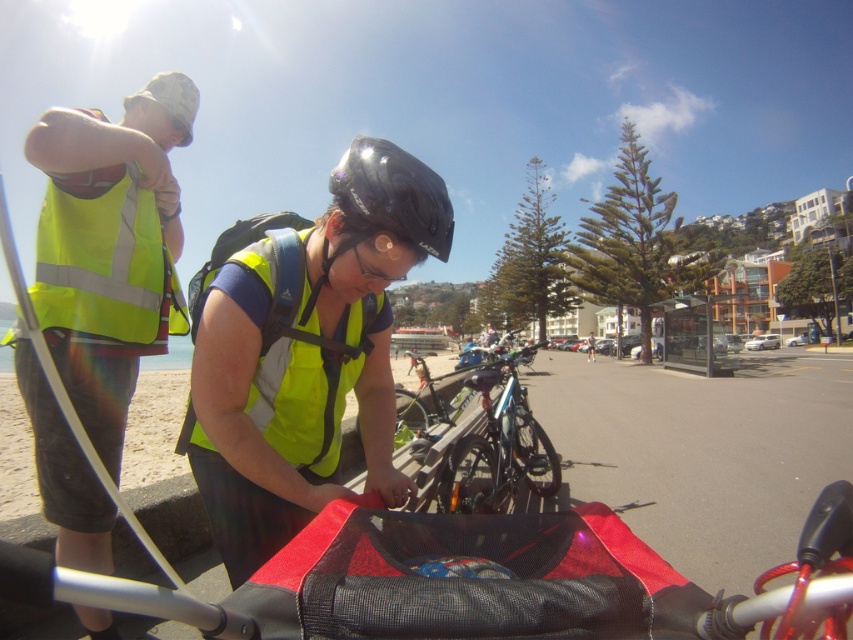
Question: Which of the following is the closest to the observer?

Choices:
 (A) glossy black helmet at center
 (B) yellow reflective safety vest at upper left

Answer: (A)

Question: Does high visibility yellow vest at left appear over glossy black helmet at center?

Choices:
 (A) yes
 (B) no

Answer: (B)

Question: Is high-visibility yellow vest at center to the right of shiny blue bike at center from the viewer's perspective?

Choices:
 (A) yes
 (B) no

Answer: (B)

Question: Is yellow reflective safety vest at center thinner than glossy black helmet at center?

Choices:
 (A) yes
 (B) no

Answer: (A)

Question: Estimate the real-world distances between objects in this image. Which object is closer to the yellow reflective safety vest at upper left?

Choices:
 (A) glossy black helmet at center
 (B) yellow reflective safety vest at center
 (C) shiny blue bike at center
 (D) high visibility yellow vest at left

Answer: (D)

Question: Among these points, which one is farthest from the camera?

Choices:
 (A) (144, 134)
 (B) (300, 241)
 (C) (285, 444)
 (D) (498, 444)

Answer: (D)